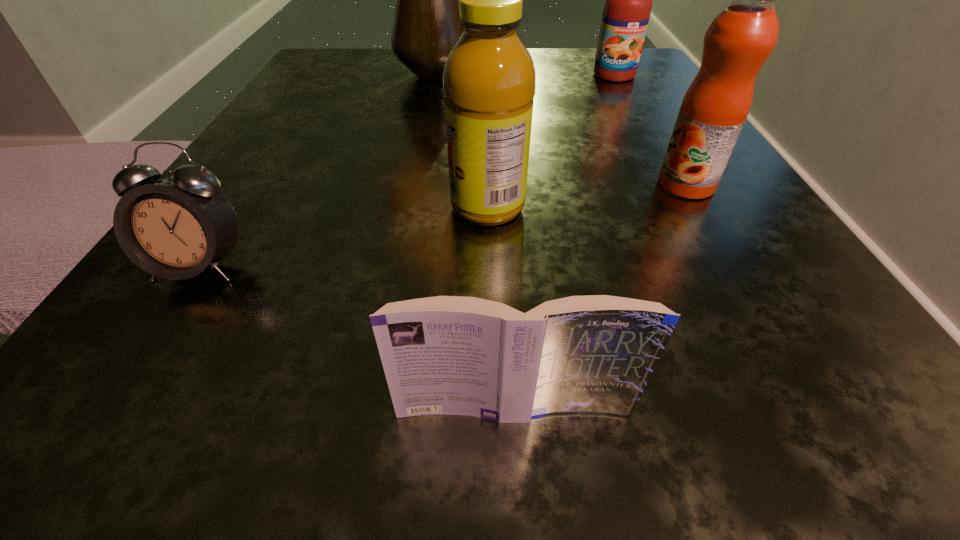
Identify the location of free space located on the front label of the leftmost fruit juice. (398, 207).

Find the location of a particular element. This screenshot has height=540, width=960. free point located 0.140m on the face of the fifth farthest object is located at coordinates (92, 434).

Where is `lampshade at the far edge`? lampshade at the far edge is located at coordinates (425, 28).

Locate an element on the screen. The image size is (960, 540). fruit juice located in the far edge section of the desktop is located at coordinates (627, 9).

Find the location of a particular element. object situated at the near edge is located at coordinates (595, 354).

Image resolution: width=960 pixels, height=540 pixels. Find the location of `lampshade that is at the left edge`. lampshade that is at the left edge is located at coordinates (425, 28).

Where is `alarm clock situated at the left edge`? alarm clock situated at the left edge is located at coordinates (176, 228).

What are the coordinates of `object located at the far left corner` in the screenshot? It's located at (425, 28).

At what (x,y) coordinates should I click in order to perform the action: click on object that is at the far right corner. Please return your answer as a coordinate pair (x, y). Looking at the image, I should click on (627, 9).

What are the coordinates of `vacant region at the far edge of the desktop` in the screenshot? It's located at (564, 89).